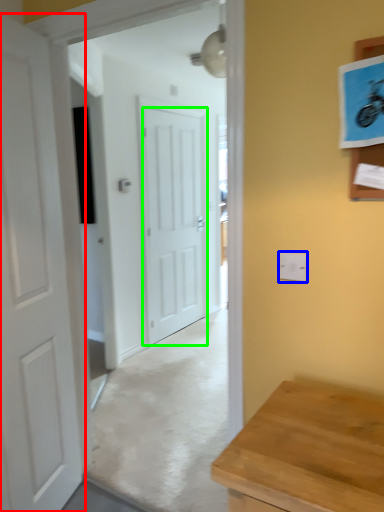
Question: Which is farther away from door (highlighted by a red box)? electric outlet (highlighted by a blue box) or door (highlighted by a green box)?

Choices:
 (A) electric outlet
 (B) door

Answer: (B)